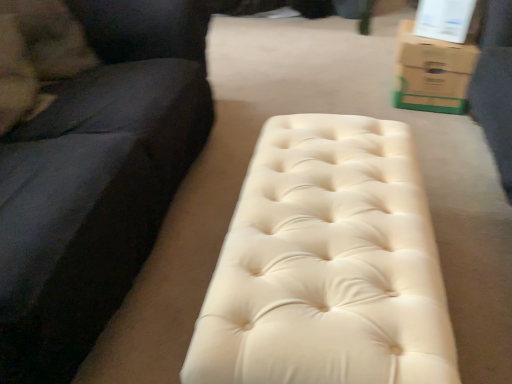
Question: Is point (371, 244) closer or farther from the camera than point (33, 132)?

Choices:
 (A) farther
 (B) closer

Answer: (B)

Question: Looking at the image, does creamy leather bench at center seem bigger or smaller compared to suede black studio couch at left?

Choices:
 (A) small
 (B) big

Answer: (A)

Question: Considering the real-world distances, which object is farthest from the creamy leather bench at center?

Choices:
 (A) brown cardboard box at upper right
 (B) suede black studio couch at left

Answer: (A)

Question: Estimate the real-world distances between objects in this image. Which object is farther from the brown cardboard box at upper right?

Choices:
 (A) suede black studio couch at left
 (B) creamy leather bench at center

Answer: (A)